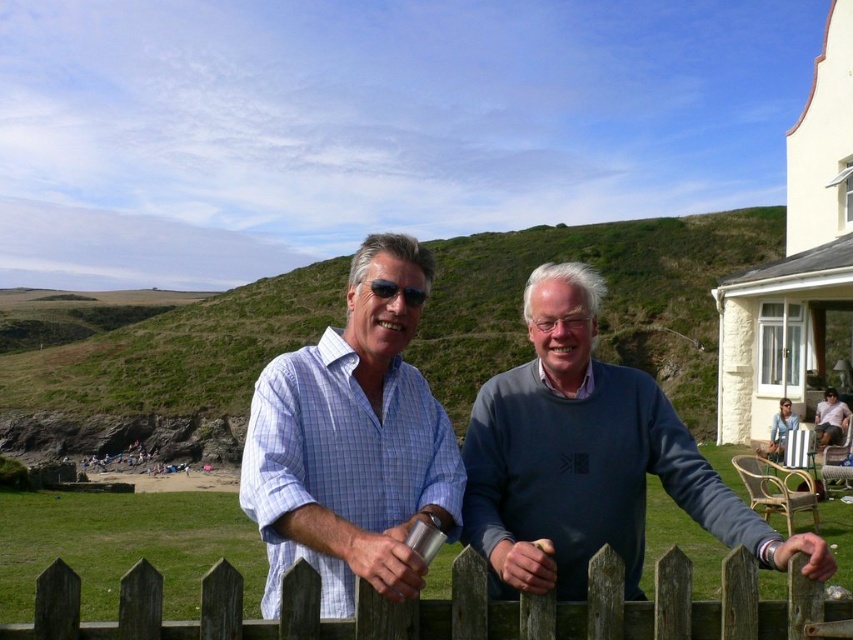
Does dark gray sweater at center have a lesser height compared to denim jacket at lower right?

In fact, dark gray sweater at center may be taller than denim jacket at lower right.

Does dark gray sweater at center have a smaller size compared to denim jacket at lower right?

No.

Which is in front, point (631, 476) or point (778, 442)?

Positioned in front is point (631, 476).

Find the location of a particular element. The height and width of the screenshot is (640, 853). dark gray sweater at center is located at coordinates (x=589, y=460).

Does wooden fence at center have a greater height compared to denim jacket at lower right?

Indeed, wooden fence at center has a greater height compared to denim jacket at lower right.

You are a GUI agent. You are given a task and a screenshot of the screen. Output one action in this format:
    pyautogui.click(x=<x>, y=<y>)
    Task: Click on the wooden fence at center
    
    Given the screenshot: What is the action you would take?
    pyautogui.click(x=453, y=608)

Can you confirm if wooden fence at center is bigger than light brown wooden chair at lower right?

Indeed, wooden fence at center has a larger size compared to light brown wooden chair at lower right.

Is wooden fence at center wider than light brown wooden chair at lower right?

Correct, the width of wooden fence at center exceeds that of light brown wooden chair at lower right.

Is point (57, 604) positioned in front of point (828, 394)?

That is True.

Where is `wooden fence at center`? The image size is (853, 640). wooden fence at center is located at coordinates (453, 608).